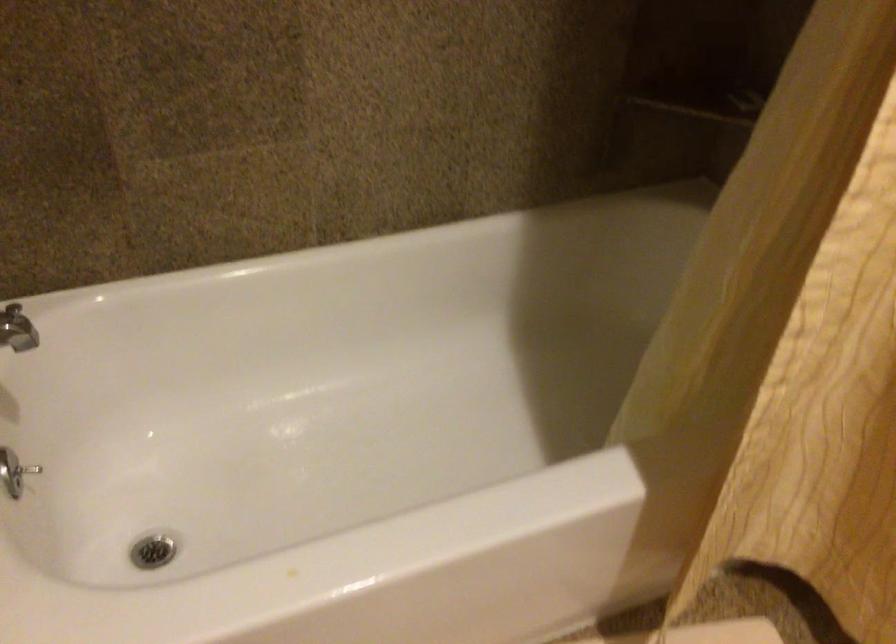
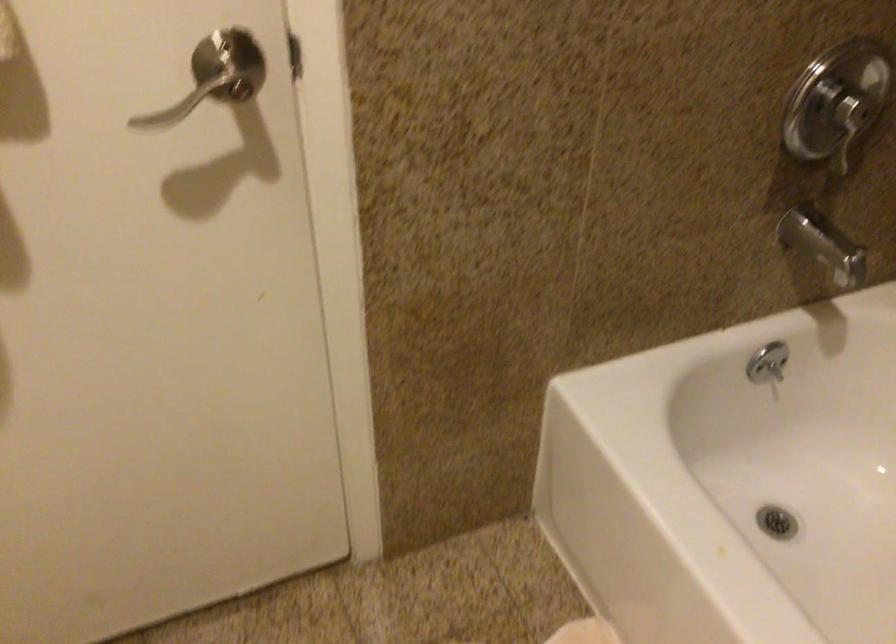
Find the pixel in the second image that matches the point at 159,563 in the first image.

(776, 522)